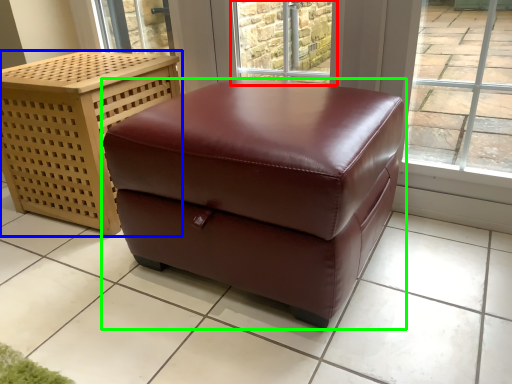
Question: Which object is positioned closest to window (highlighted by a red box)? Select from furniture (highlighted by a blue box) and table (highlighted by a green box).

Choices:
 (A) furniture
 (B) table

Answer: (A)